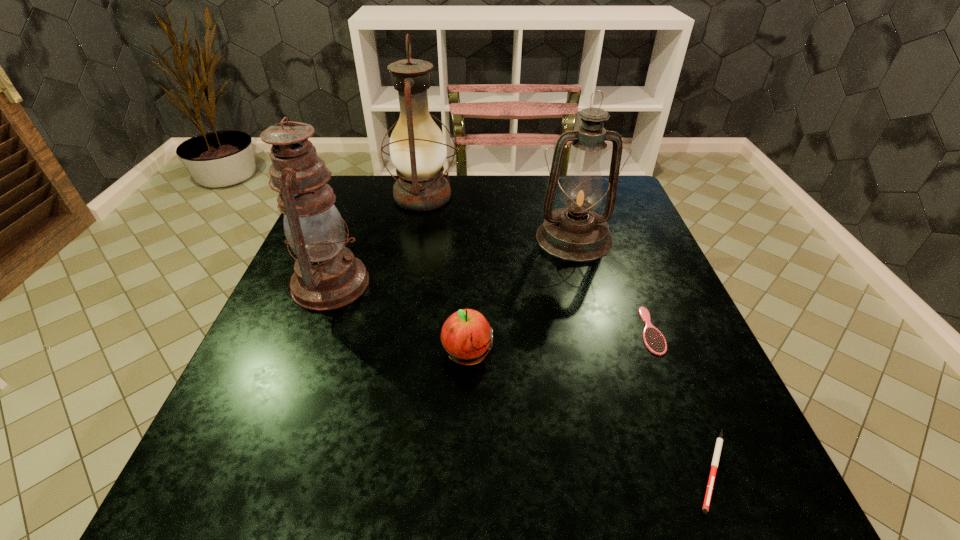
The width and height of the screenshot is (960, 540). I want to click on free space between the hairbrush and the fourth tallest object, so click(559, 343).

Locate an element on the screen. This screenshot has height=540, width=960. free spot between the fifth tallest object and the pen is located at coordinates (682, 400).

Locate an element on the screen. This screenshot has height=540, width=960. object identified as the second closest to the hairbrush is located at coordinates (576, 233).

The width and height of the screenshot is (960, 540). Identify the location of object that is the third closest to the fifth tallest object. (466, 337).

The height and width of the screenshot is (540, 960). What are the coordinates of `oil lamp that can be found as the second closest to the shortest object` in the screenshot? It's located at (327, 276).

Identify the location of oil lamp that stands as the third closest to the second shortest object. (327, 276).